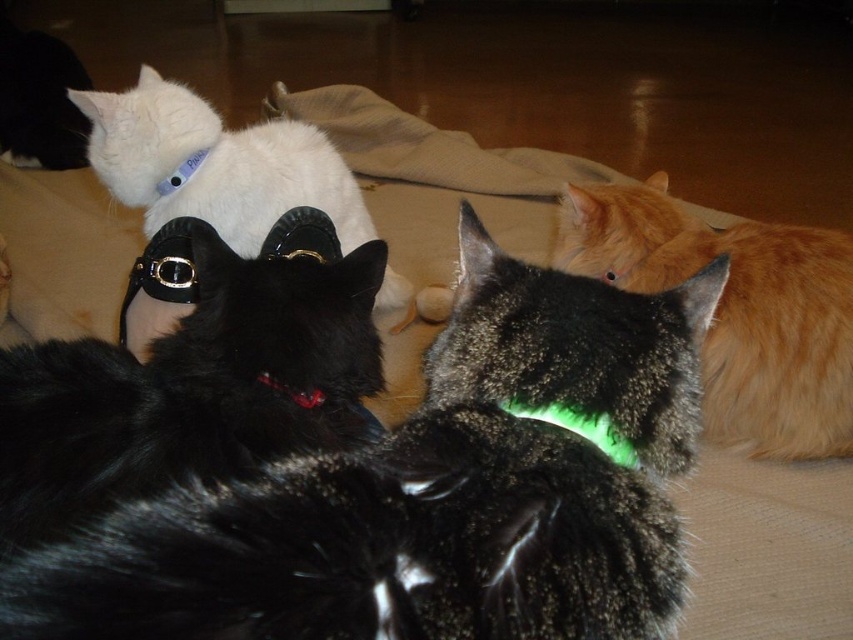
Question: Is the position of shiny black cat at center less distant than that of green fluorescent plastic at center?

Choices:
 (A) no
 (B) yes

Answer: (B)

Question: Which of these objects is positioned closest to the black glossy shoe at upper left?

Choices:
 (A) shiny red plastic collar at center
 (B) white fur cat at upper left

Answer: (A)

Question: Which point is farther to the camera?

Choices:
 (A) shiny red plastic collar at center
 (B) white fur cat at upper left

Answer: (B)

Question: Which point is farther from the camera taking this photo?

Choices:
 (A) (606, 426)
 (B) (619, 392)
 (C) (117, 477)

Answer: (C)

Question: Is black glossy shoe at upper left bigger than green fluorescent plastic at center?

Choices:
 (A) yes
 (B) no

Answer: (A)

Question: Is black glossy shoe at upper left positioned before white fur cat at upper left?

Choices:
 (A) yes
 (B) no

Answer: (A)